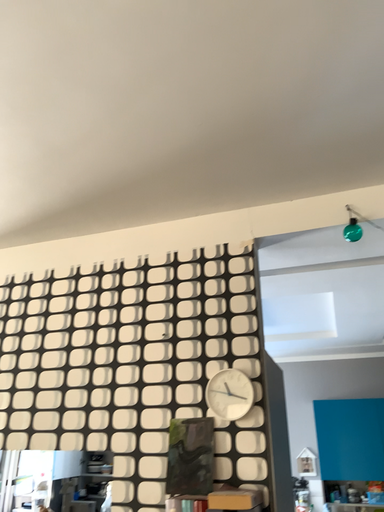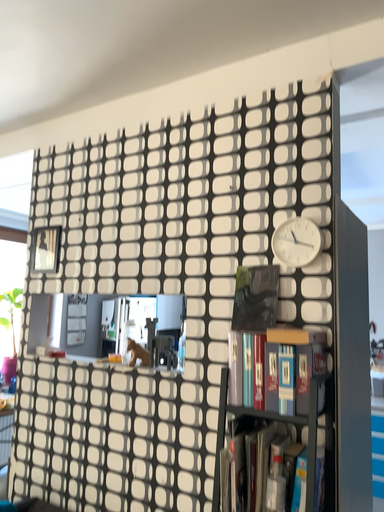
Question: How did the camera likely rotate when shooting the video?

Choices:
 (A) rotated left
 (B) rotated right

Answer: (A)